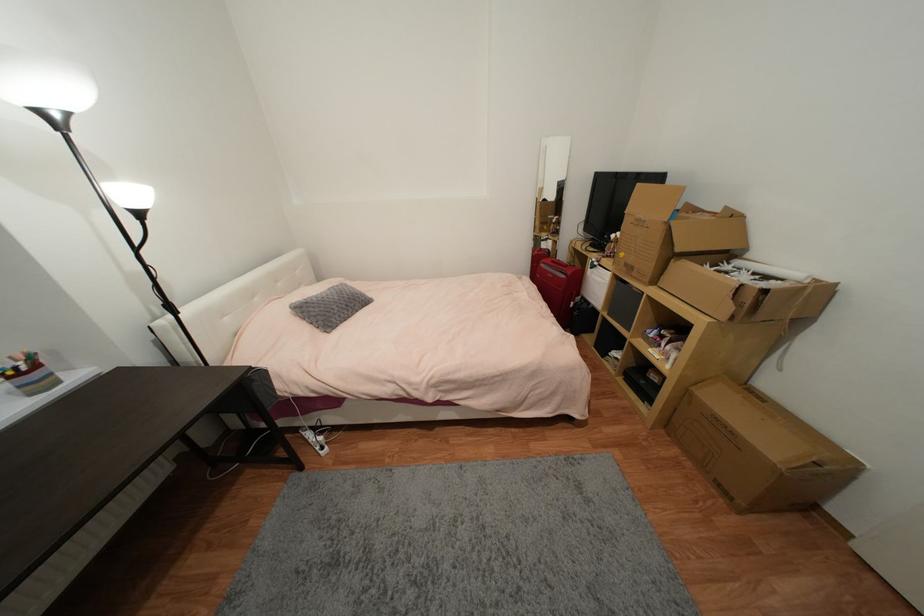
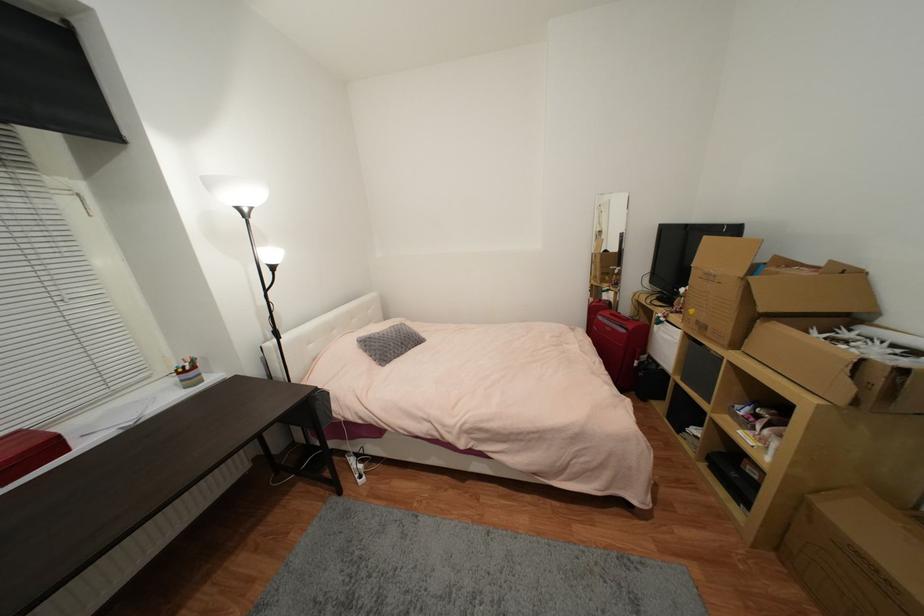
Locate, in the second image, the point that corresponds to the point at 682,251 in the first image.

(767, 310)